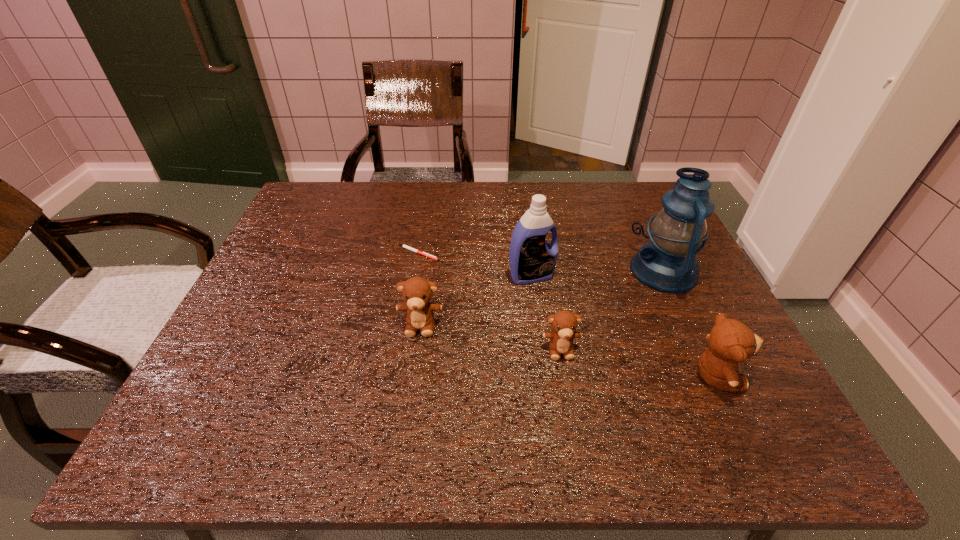
Image resolution: width=960 pixels, height=540 pixels. Find the location of `free region located on the face of the second teddy bear from left to right`. free region located on the face of the second teddy bear from left to right is located at coordinates (566, 382).

Identify the location of vacant area situated on the face of the lantern. This screenshot has width=960, height=540. (571, 271).

Where is `free space located on the face of the lantern`? The width and height of the screenshot is (960, 540). free space located on the face of the lantern is located at coordinates (567, 271).

The image size is (960, 540). In order to click on free point located 0.100m on the face of the lantern in this screenshot , I will do `click(591, 271)`.

The image size is (960, 540). In order to click on vacant area situated on the clicker of the pen in this screenshot , I will do `click(505, 253)`.

Find the location of a particular element. Image resolution: width=960 pixels, height=540 pixels. free space located 0.230m on the front of the second tallest object is located at coordinates (542, 362).

What are the coordinates of `object that is at the near edge` in the screenshot? It's located at (730, 341).

This screenshot has width=960, height=540. Identify the location of teddy bear at the right edge. (730, 341).

Find the location of a particular element. lantern that is at the right edge is located at coordinates (668, 263).

Image resolution: width=960 pixels, height=540 pixels. Find the location of `object that is at the near right corner`. object that is at the near right corner is located at coordinates (730, 341).